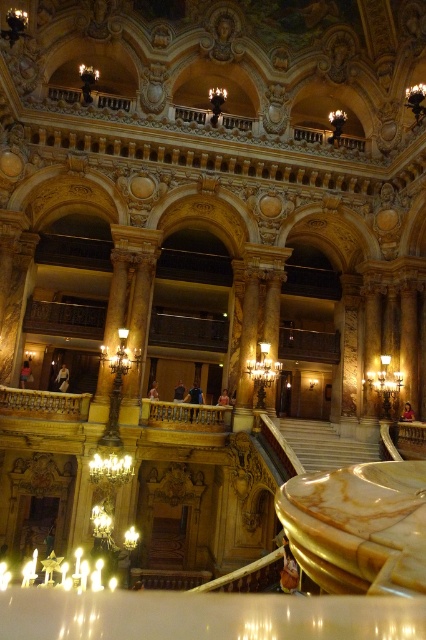
Question: Which point is farther from the camera taking this photo?

Choices:
 (A) (359, 458)
 (B) (336, 112)

Answer: (B)

Question: Does white marble stairs at center appear on the left side of gold ornate railing at upper center?

Choices:
 (A) no
 (B) yes

Answer: (A)

Question: Does white marble stairs at center appear under gold ornate railing at upper center?

Choices:
 (A) yes
 (B) no

Answer: (A)

Question: Can you confirm if white marble stairs at center is positioned below gold ornate railing at upper center?

Choices:
 (A) no
 (B) yes

Answer: (B)